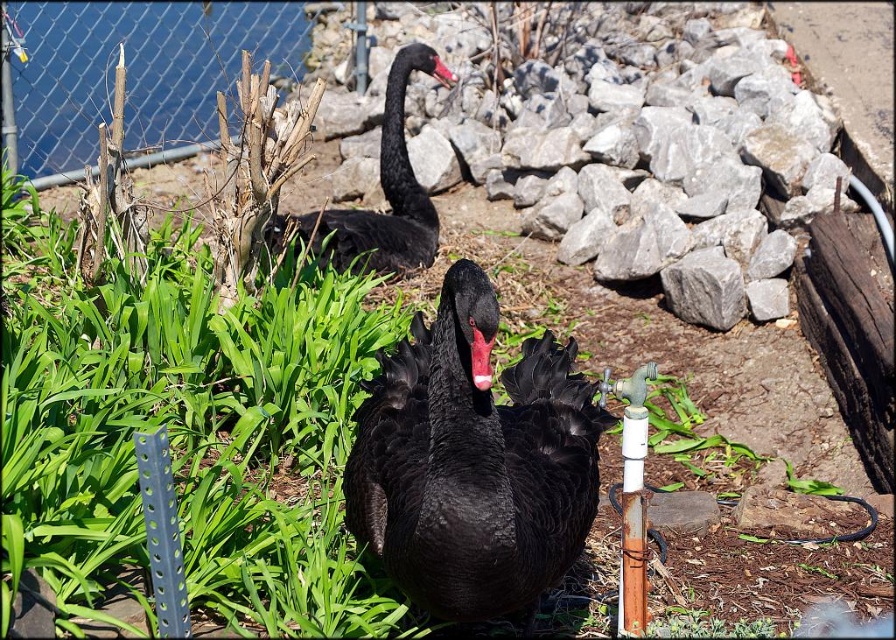
Which of these two, metallic chain-link fence at upper left or red matte beak at center, stands taller?

With more height is metallic chain-link fence at upper left.

The height and width of the screenshot is (640, 896). What are the coordinates of `metallic chain-link fence at upper left` in the screenshot? It's located at (135, 74).

The width and height of the screenshot is (896, 640). Find the location of `metallic chain-link fence at upper left`. metallic chain-link fence at upper left is located at coordinates (135, 74).

Is metallic chain-link fence at upper left positioned behind black matte beak at upper center?

Yes, metallic chain-link fence at upper left is further from the viewer.

Based on the photo, is metallic chain-link fence at upper left below black matte beak at upper center?

No, metallic chain-link fence at upper left is not below black matte beak at upper center.

Locate an element on the screen. The image size is (896, 640). metallic chain-link fence at upper left is located at coordinates (135, 74).

What do you see at coordinates (135, 74) in the screenshot? I see `metallic chain-link fence at upper left` at bounding box center [135, 74].

Who is shorter, metallic chain-link fence at upper left or matte black swan at upper center?

matte black swan at upper center is shorter.

Which is behind, point (214, 92) or point (393, 218)?

Positioned behind is point (214, 92).

I want to click on metallic chain-link fence at upper left, so click(135, 74).